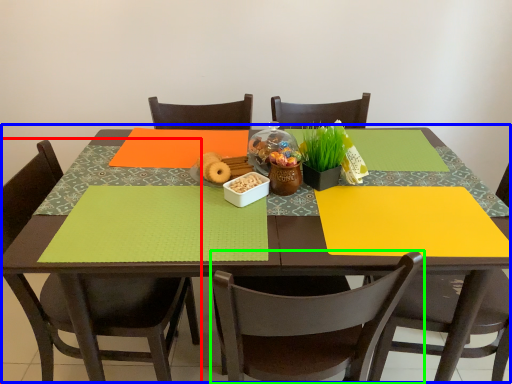
Question: Which object is the closest to the chair (highlighted by a red box)? Choose among these: table (highlighted by a blue box) or chair (highlighted by a green box).

Choices:
 (A) table
 (B) chair

Answer: (A)